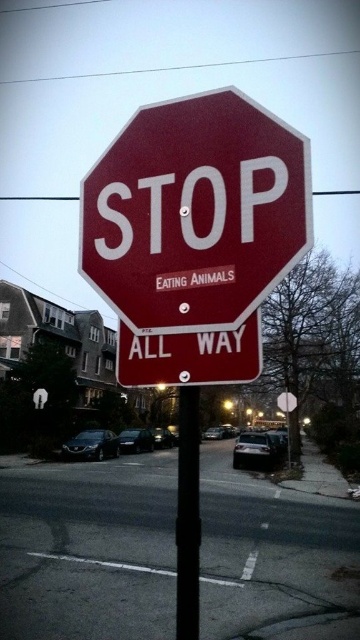
Is smooth asphalt road at center positioned in front of matte red stop sign at center?

No.

Between smooth asphalt road at center and matte red stop sign at center, which one appears on the left side from the viewer's perspective?

matte red stop sign at center is more to the left.

Is point (313, 632) farther from camera compared to point (118, 189)?

That is True.

This screenshot has width=360, height=640. Find the location of `smooth asphalt road at center`. smooth asphalt road at center is located at coordinates (88, 548).

You are a GUI agent. You are given a task and a screenshot of the screen. Output one action in this format:
    pyautogui.click(x=<x>, y=<y>)
    Task: Click on the red matte sign at center
    The width and height of the screenshot is (360, 640).
    Given the screenshot: What is the action you would take?
    pyautogui.click(x=190, y=356)

How far apart are red matte sign at center and black metal pole at center?

red matte sign at center and black metal pole at center are 1.19 meters apart from each other.

Is point (219, 349) closer to camera compared to point (198, 637)?

No, (219, 349) is behind (198, 637).

The width and height of the screenshot is (360, 640). Identify the location of red matte sign at center. (190, 356).

Is matte red stop sign at center thinner than red matte sign at center?

No, matte red stop sign at center is not thinner than red matte sign at center.

Based on the photo, between matte red stop sign at center and red matte sign at center, which one is positioned higher?

matte red stop sign at center

Is point (225, 246) farther from camera compared to point (187, 365)?

Yes, point (225, 246) is behind point (187, 365).

This screenshot has width=360, height=640. I want to click on matte red stop sign at center, so click(x=195, y=212).